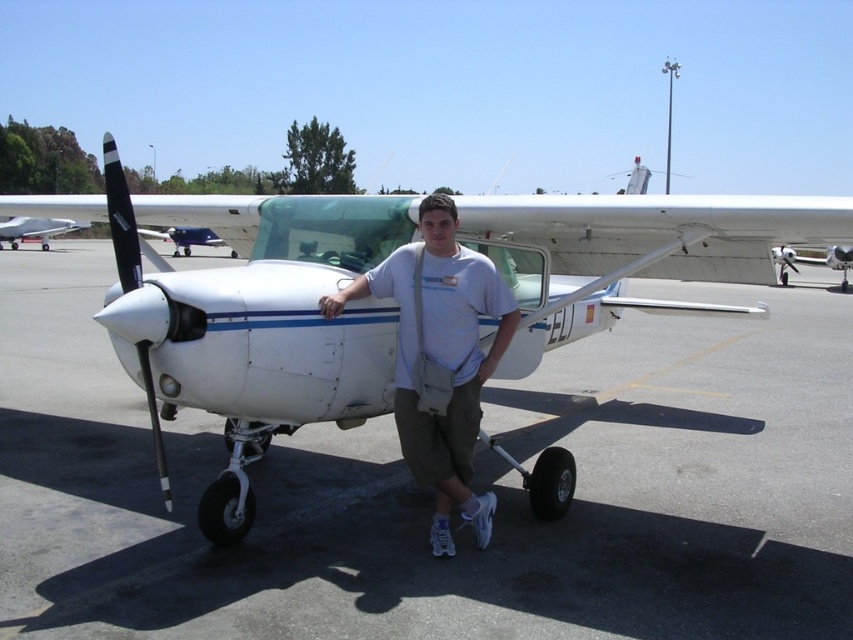
Question: Which point is farther from the camera taking this photo?

Choices:
 (A) (219, 241)
 (B) (200, 321)

Answer: (A)

Question: Estimate the real-world distances between objects in this image. Which object is farther from the white glossy airplane at left?

Choices:
 (A) white glossy airplane at center
 (B) white matte airplane at center

Answer: (B)

Question: Which point is farther to the camera?

Choices:
 (A) white glossy airplane at center
 (B) white glossy airplane at left
 (C) white cotton t-shirt at center
 (D) white matte airplane at center

Answer: (B)

Question: Can you confirm if white cotton t-shirt at center is wider than white glossy airplane at left?

Choices:
 (A) yes
 (B) no

Answer: (B)

Question: Is white matte airplane at center positioned in front of white glossy airplane at center?

Choices:
 (A) yes
 (B) no

Answer: (B)

Question: Can you confirm if white cotton t-shirt at center is smaller than white glossy airplane at center?

Choices:
 (A) no
 (B) yes

Answer: (B)